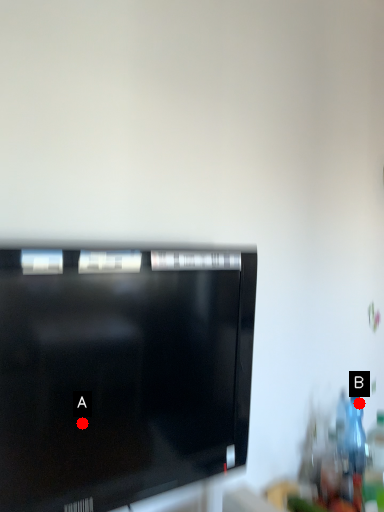
Question: Two points are circled on the image, labeled by A and B beside each circle. Which point is farther to the camera?

Choices:
 (A) A is further
 (B) B is further

Answer: (B)